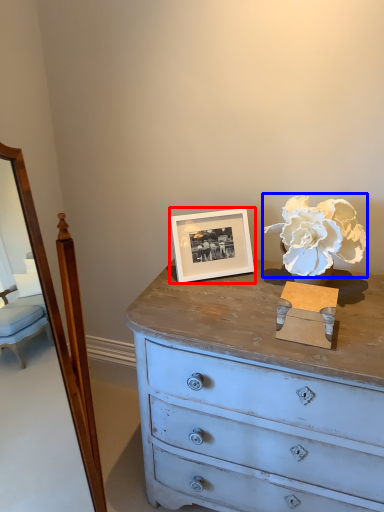
Question: Which point is closer to the camera, picture frame (highlighted by a red box) or flower (highlighted by a blue box)?

Choices:
 (A) picture frame
 (B) flower

Answer: (B)